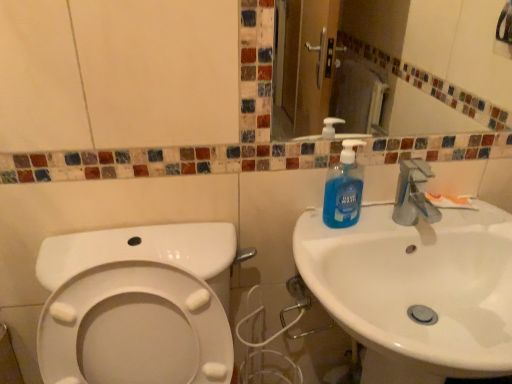
Question: Is white glossy sink at right to the right of white matte toothpaste at sink right from the viewer's perspective?

Choices:
 (A) no
 (B) yes

Answer: (A)

Question: Can you confirm if white glossy sink at right is thinner than white matte toothpaste at sink right?

Choices:
 (A) no
 (B) yes

Answer: (A)

Question: From the image's perspective, is white glossy sink at right below white matte toothpaste at sink right?

Choices:
 (A) yes
 (B) no

Answer: (A)

Question: Does white glossy sink at right come behind white matte toothpaste at sink right?

Choices:
 (A) no
 (B) yes

Answer: (A)

Question: Is white glossy sink at right shorter than white matte toothpaste at sink right?

Choices:
 (A) yes
 (B) no

Answer: (B)

Question: Is white matte toothpaste at sink right bigger or smaller than blue liquid soap at sink right?

Choices:
 (A) small
 (B) big

Answer: (A)

Question: In terms of height, does white matte toothpaste at sink right look taller or shorter compared to blue liquid soap at sink right?

Choices:
 (A) short
 (B) tall

Answer: (A)

Question: Is point (446, 205) positioned closer to the camera than point (332, 221)?

Choices:
 (A) farther
 (B) closer

Answer: (A)

Question: Is white matte toothpaste at sink right situated inside blue liquid soap at sink right or outside?

Choices:
 (A) outside
 (B) inside

Answer: (A)

Question: From their relative heights in the image, would you say blue liquid soap at sink right is taller or shorter than white glossy sink at right?

Choices:
 (A) short
 (B) tall

Answer: (A)

Question: From the image's perspective, is blue liquid soap at sink right positioned above or below white glossy sink at right?

Choices:
 (A) below
 (B) above

Answer: (B)

Question: Based on their sizes in the image, would you say blue liquid soap at sink right is bigger or smaller than white glossy sink at right?

Choices:
 (A) big
 (B) small

Answer: (B)

Question: Is blue liquid soap at sink right spatially inside white glossy sink at right, or outside of it?

Choices:
 (A) inside
 (B) outside

Answer: (A)

Question: From a real-world perspective, is blue liquid soap at sink right positioned above or below white matte toothpaste at sink right?

Choices:
 (A) above
 (B) below

Answer: (A)

Question: Is point (339, 221) positioned closer to the camera than point (443, 205)?

Choices:
 (A) closer
 (B) farther

Answer: (A)